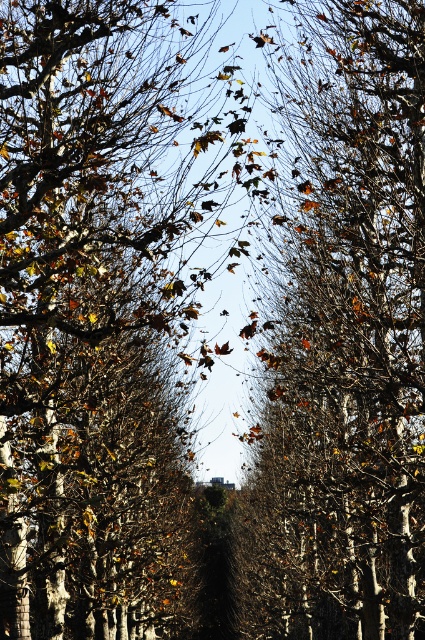
You are a landscape architect designing a walking path through a forest. You need to ensure that the path is wide enough for two people to walk side by side. The path is currently between the brown leafy tree at center and the brown matte tree at center. Can the path accommodate two people walking side by side?

The brown leafy tree at center is narrower than the brown matte tree at center. The path between them is therefore wide enough to accommodate two people walking side by side.

You are standing at the starting point of the autumn pathway and want to reach a destination marked by two points, point A at point A is point (104, 451) and point B is point (326, 406). Which point is closer to you, point A or point B?

Point A at point (104, 451) is closer to the camera than point B at point (326, 406), so point A is closer to you.

You are walking along a pathway between two rows of trees and notice two trees at the center of your view. One is labeled as the brown leafy tree at center and the other as the brown matte tree at center. Which tree would block your view of the other if you were to look directly at them?

The brown leafy tree at center is in front of the brown matte tree at center, so it would block the view of the brown matte tree at center.